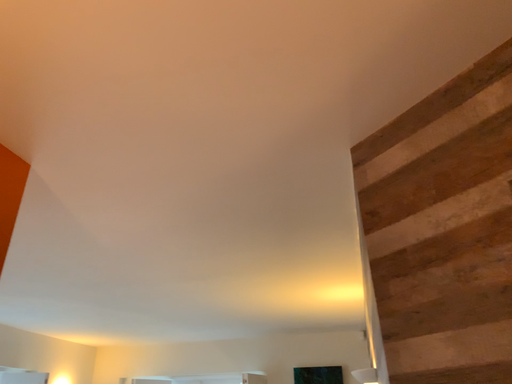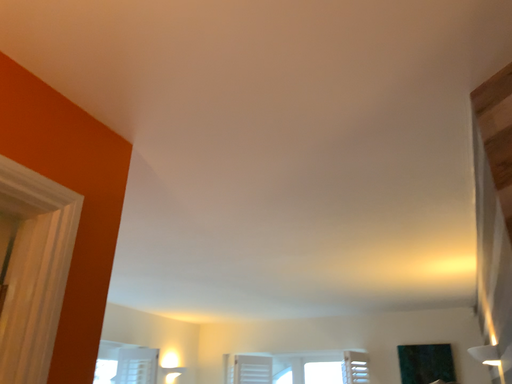
Question: Which way did the camera rotate in the video?

Choices:
 (A) rotated right
 (B) rotated left

Answer: (B)